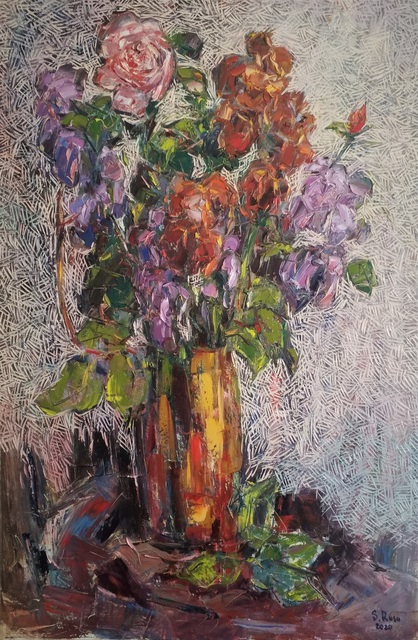
You are a GUI agent. You are given a task and a screenshot of the screen. Output one action in this format:
    pyautogui.click(x=<x>, y=<y>)
    Task: Click on the space above floors
    
    Given the screenshot: What is the action you would take?
    pyautogui.click(x=192, y=1)